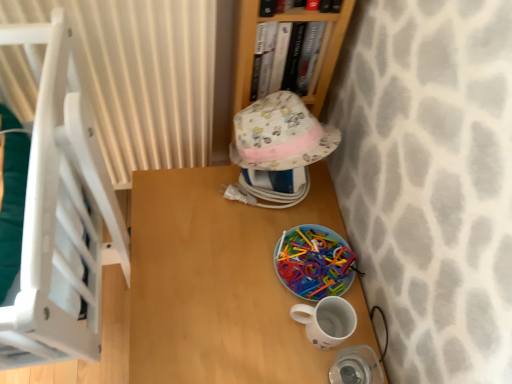
Identify the location of blank space situated above wooden table at center (from a real-world perspective). The width and height of the screenshot is (512, 384). (238, 263).